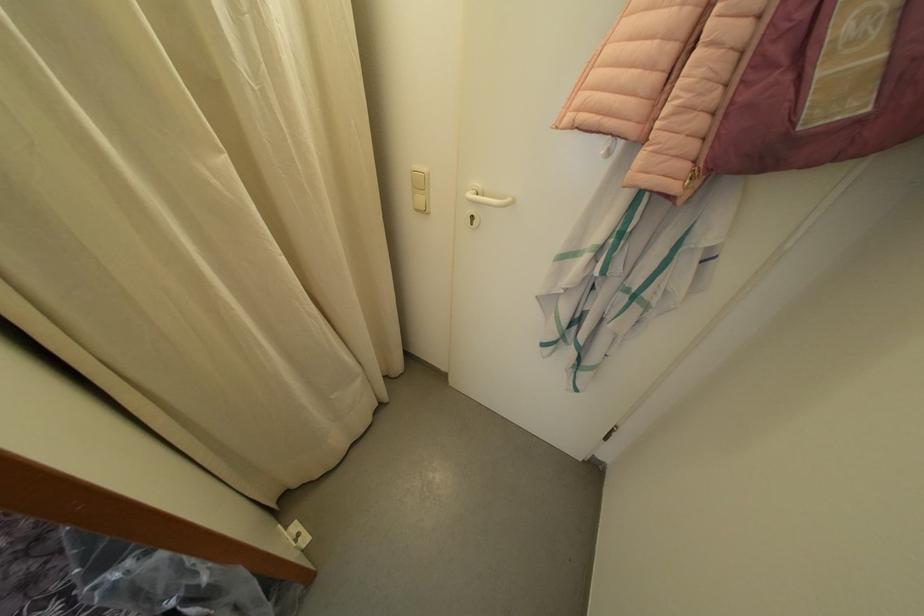
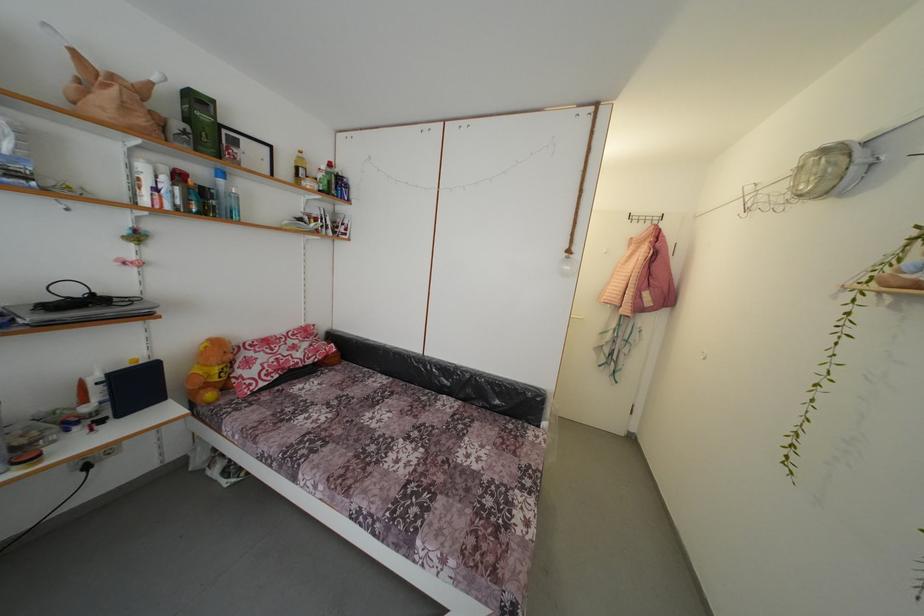
The images are taken continuously from a first-person perspective. In which direction are you moving?

The movement direction of the cameraman is left, backward.